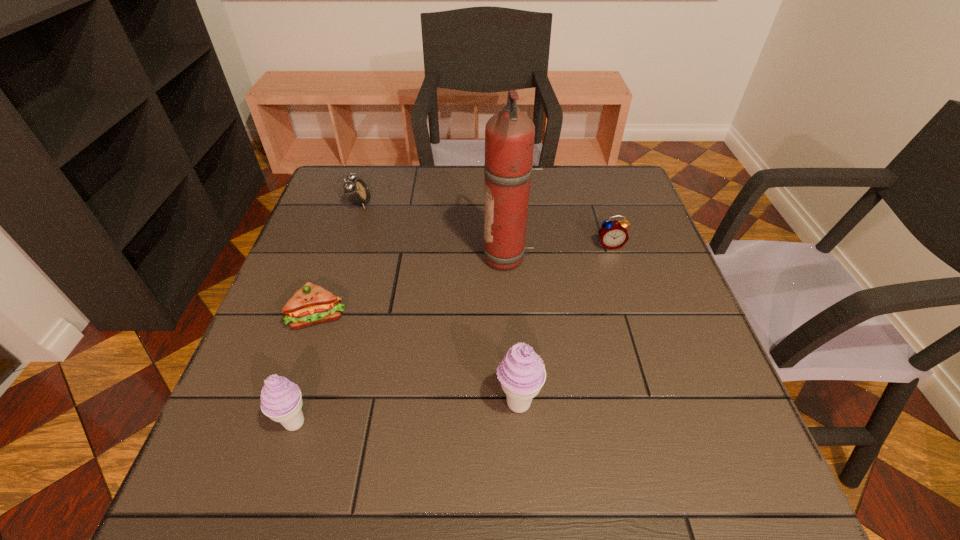
In the current image, all icecreams are evenly spaced. To maintain this equal spacing, where should an additional icecream be placed on the right? Please point out a free spot. Please provide its 2D coordinates. Your answer should be formatted as a tuple, i.e. [(x, y)], where the tuple contains the x and y coordinates of a point satisfying the conditions above.

[(726, 384)]